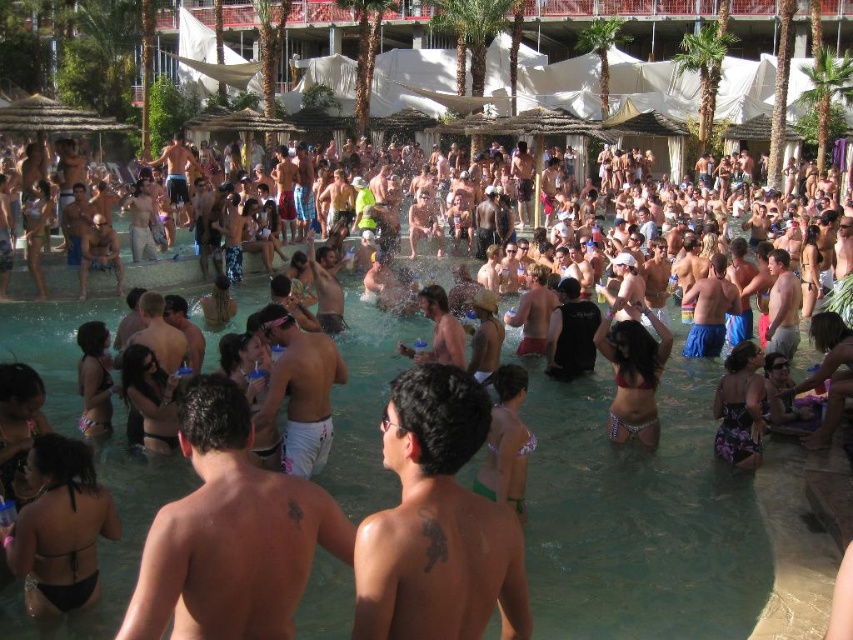
Consider the image. Which of these two, dark bikini at center or smooth tan skin at center, stands taller?

dark bikini at center is taller.

Is point (56, 456) in front of point (438, 333)?

Yes.

At what (x,y) coordinates should I click in order to perform the action: click on dark bikini at center. Please return your answer as a coordinate pair (x, y). The image size is (853, 640). Looking at the image, I should click on (59, 528).

Can you confirm if dark bikini at center is taller than white cotton shorts at center?

Indeed, dark bikini at center has a greater height compared to white cotton shorts at center.

Is dark bikini at center wider than white cotton shorts at center?

Yes.

Locate an element on the screen. Image resolution: width=853 pixels, height=640 pixels. dark bikini at center is located at coordinates (59, 528).

Is white cotton shorts at center thinner than floral print bikini bottom at center?

Yes, white cotton shorts at center is thinner than floral print bikini bottom at center.

What do you see at coordinates (299, 388) in the screenshot?
I see `white cotton shorts at center` at bounding box center [299, 388].

Between point (273, 305) and point (741, 348), which one is positioned in front?

Point (273, 305) is in front.

At what (x,y) coordinates should I click in order to perform the action: click on white cotton shorts at center. Please return your answer as a coordinate pair (x, y). Image resolution: width=853 pixels, height=640 pixels. Looking at the image, I should click on (x=299, y=388).